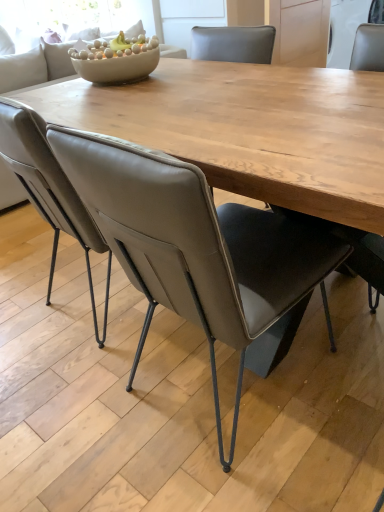
Measure the distance between point (160,296) and camera.

Point (160,296) and camera are 3.65 feet apart from each other.

What are the coordinates of `leather chair at center` in the screenshot? It's located at (195, 246).

In order to face leather chair at center, should I rotate leftwards or rightwards?

A 3.428 degree turn to the right will do.

Describe the element at coordinates (195, 246) in the screenshot. I see `leather chair at center` at that location.

Identify the location of leather chair at center. The height and width of the screenshot is (512, 384). (195, 246).